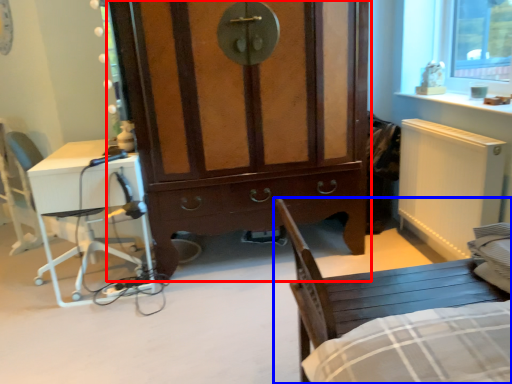
Question: Which point is closer to the camera, cabinetry (highlighted by a red box) or chair (highlighted by a blue box)?

Choices:
 (A) cabinetry
 (B) chair

Answer: (B)